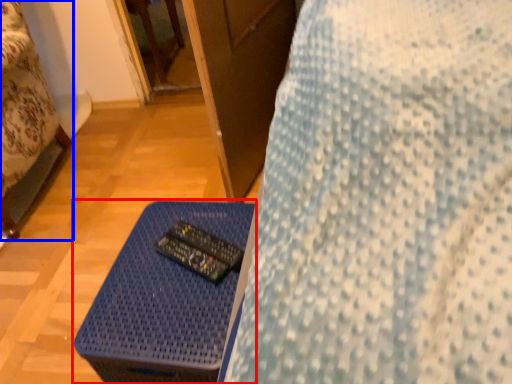
Question: Which object is closer to the camera taking this photo, table (highlighted by a red box) or furniture (highlighted by a blue box)?

Choices:
 (A) table
 (B) furniture

Answer: (A)